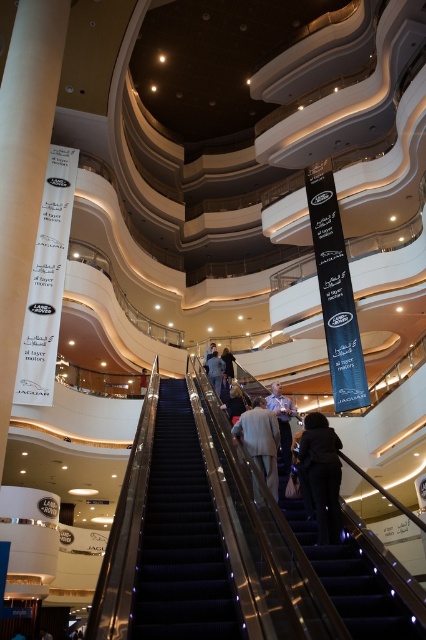
Question: Which point is farther to the camera?

Choices:
 (A) white paper banner at left
 (B) dark blue fabric jacket at center
 (C) light beige fabric jacket at center
 (D) light blue shirt at center

Answer: (C)

Question: Which object is positioned farthest from the dark blue fabric jacket at center?

Choices:
 (A) light brown leather jacket at center
 (B) light blue shirt at center
 (C) light beige fabric jacket at center
 (D) white paper banner at left

Answer: (A)

Question: Does light blue shirt at center come behind light brown leather jacket at center?

Choices:
 (A) yes
 (B) no

Answer: (B)

Question: Is black carpeted stairs at center further to the viewer compared to light brown leather jacket at center?

Choices:
 (A) yes
 (B) no

Answer: (B)

Question: Among these points, which one is nearest to the camera?

Choices:
 (A) (313, 477)
 (B) (9, 218)
 (C) (212, 346)

Answer: (A)

Question: Is light gray fabric jacket at center smaller than light brown leather jacket at center?

Choices:
 (A) no
 (B) yes

Answer: (A)